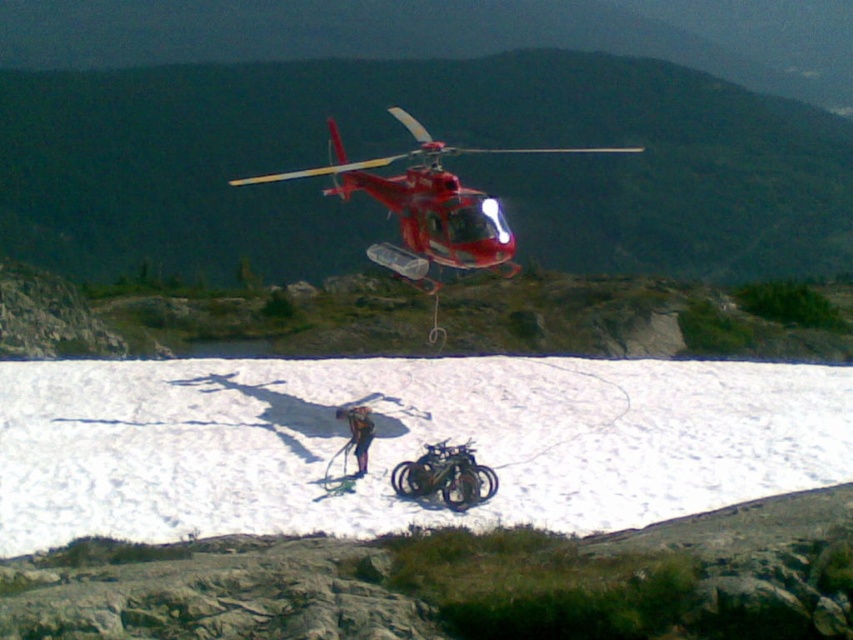
A helicopter pilot is flying a red helicopter with white accents. They need to land the helicopter safely on the snowy ground. The pilot must ensure that the helicopter stays at least 10 meters away from any obstacles. There is a person standing near a small wheeled vehicle at point (460, 256). Can the pilot land the helicopter safely without violating the safety distance requirement?

The helicopter and the person at point (460, 256) are 12.12 meters apart. Since 12.12 meters is greater than the required 10 meters safety distance, the pilot can land the helicopter safely without violating the safety distance requirement.

You are a passenger in the shiny red helicopter at center and want to exit to the shiny metallic motorcycle at center. Which direction should you move to reach it?

The shiny metallic motorcycle at center is closer to you than the shiny red helicopter at center, so you should move downward to reach it.

You are a passenger in the helicopter and need to decide whether to land on the shiny metallic motorcycle at center or the brown leather jacket at center. Which object is shorter and safer for landing?

The shiny metallic motorcycle at center is shorter than the brown leather jacket at center, making it the safer option for landing.